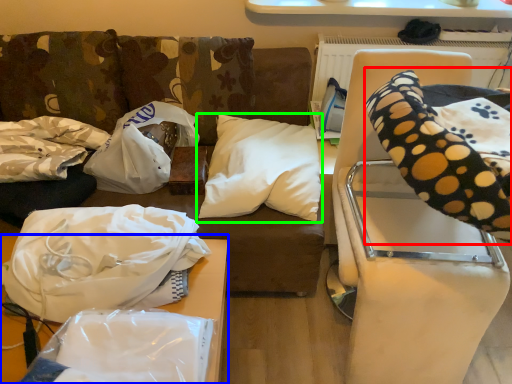
Question: Which is nearer to the bean bag chair (highlighted by a red box)? furniture (highlighted by a blue box) or pillow (highlighted by a green box).

Choices:
 (A) furniture
 (B) pillow

Answer: (B)